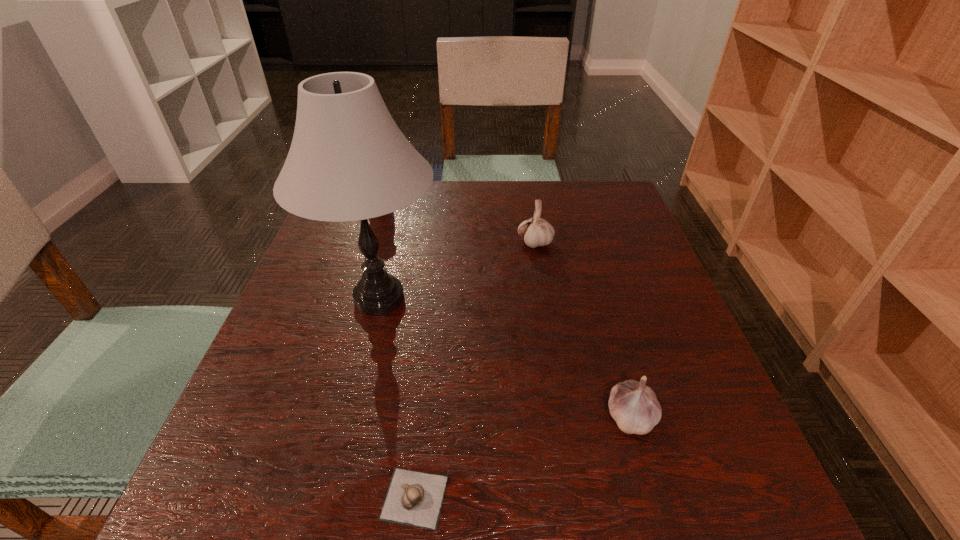
In order to click on blank region between the second nearest garlic and the shortest garlic in this screenshot , I will do `click(522, 457)`.

Identify the location of free space between the shortest garlic and the rightmost garlic. (522, 457).

Find the location of a particular element. The width and height of the screenshot is (960, 540). free spot between the tallest object and the leftmost garlic is located at coordinates (396, 398).

Locate an element on the screen. vacant area between the nearest garlic and the farthest object is located at coordinates (475, 370).

Identify the location of the second closest object relative to the leftmost garlic. Image resolution: width=960 pixels, height=540 pixels. (633, 405).

Select which object appears as the second closest to the second farthest garlic. Please provide its 2D coordinates. Your answer should be formatted as a tuple, i.e. [(x, y)], where the tuple contains the x and y coordinates of a point satisfying the conditions above.

[(348, 161)]

Point out which garlic is positioned as the second nearest to the leftmost garlic. Please provide its 2D coordinates. Your answer should be formatted as a tuple, i.e. [(x, y)], where the tuple contains the x and y coordinates of a point satisfying the conditions above.

[(537, 232)]

The image size is (960, 540). In order to click on garlic object that ranks as the second closest to the third farthest object in this screenshot , I will do `click(537, 232)`.